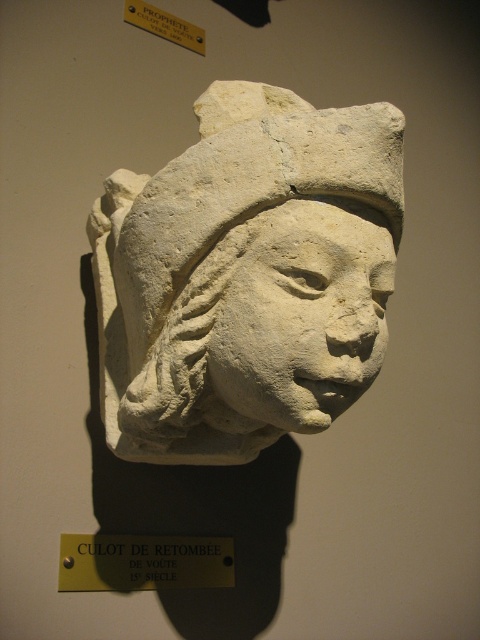
You are an art conservator examining the sculpture. You notice two points on the sculpture marked at coordinates point [297,371] and point [98,550]. Which point is more likely to be in a position that requires immediate attention due to potential surface erosion caused by exposure to the environment?

Point [297,371] is closer to the camera than point [98,550], so it is more likely to be in a position that requires immediate attention due to potential surface erosion caused by exposure to the environment.

You are an art conservator examining the stone sculptures in the image. You notice two objects labeled as white stone head at center and white stone face at center. Which one is positioned to the left?

The white stone head at center is positioned to the left of the white stone face at center.